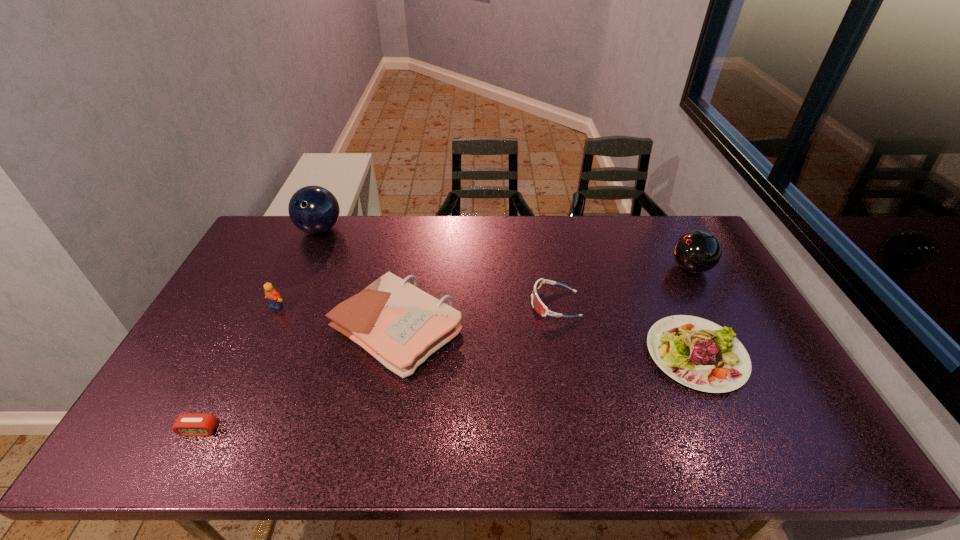
Where is `vacant area situated on the left of the salad plate`? Image resolution: width=960 pixels, height=540 pixels. vacant area situated on the left of the salad plate is located at coordinates (629, 354).

This screenshot has height=540, width=960. Identify the location of object that is at the near edge. (186, 424).

Where is `bowling ball located at the left edge`? This screenshot has width=960, height=540. bowling ball located at the left edge is located at coordinates (313, 209).

The height and width of the screenshot is (540, 960). In order to click on Lego located in the left edge section of the desktop in this screenshot , I will do `click(273, 297)`.

Where is `alarm clock present at the left edge`? The image size is (960, 540). alarm clock present at the left edge is located at coordinates (186, 424).

Where is `bowling ball that is at the right edge`? The image size is (960, 540). bowling ball that is at the right edge is located at coordinates (697, 251).

The image size is (960, 540). Find the location of `salad plate situated at the right edge`. salad plate situated at the right edge is located at coordinates (700, 354).

This screenshot has width=960, height=540. Identify the location of object that is at the far left corner. (313, 209).

Locate an element on the screen. The width and height of the screenshot is (960, 540). object that is positioned at the near left corner is located at coordinates (186, 424).

Identify the location of object that is at the far right corner. This screenshot has width=960, height=540. (697, 251).